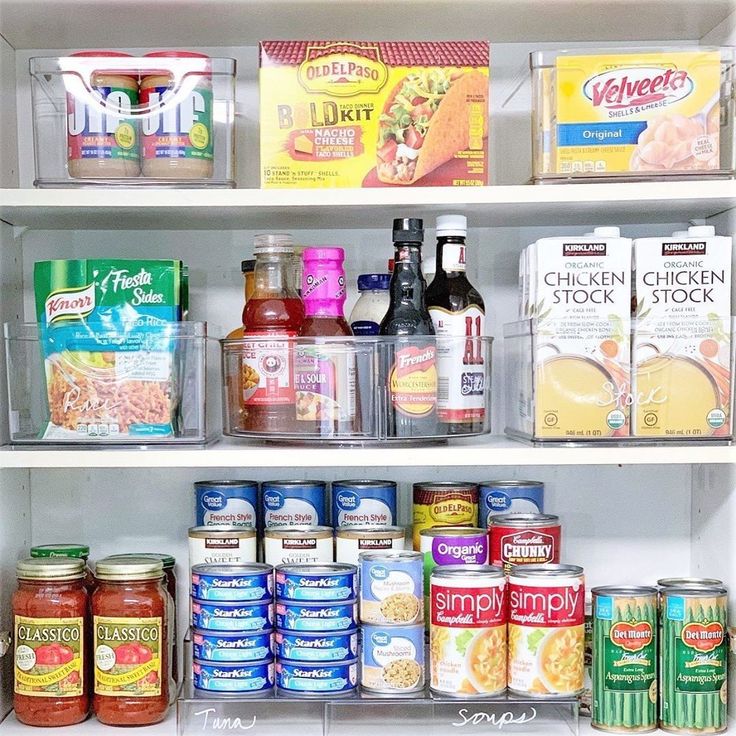
In order to click on boxes in this screenshot , I will do `click(346, 96)`, `click(647, 102)`, `click(580, 257)`, `click(670, 266)`, `click(523, 276)`.